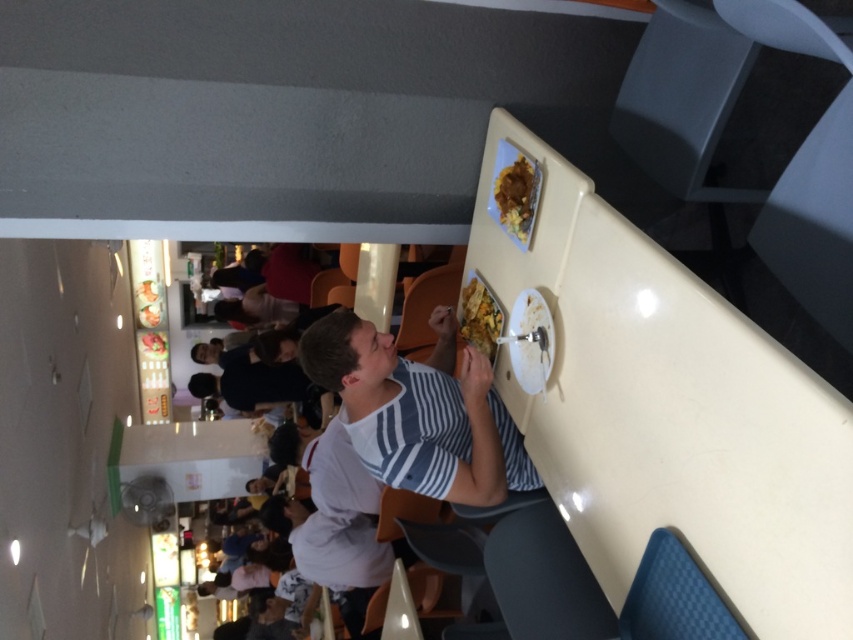
Question: Among these points, which one is farthest from the camera?

Choices:
 (A) (152, 296)
 (B) (148, 339)
 (C) (515, 179)
 (D) (148, 308)

Answer: (B)

Question: Is yellow matte food at upper right wider than matte white plate at upper center?

Choices:
 (A) yes
 (B) no

Answer: (B)

Question: Estimate the real-world distances between objects in this image. Which object is farther from the white striped shirt at center?

Choices:
 (A) yellow matte food at upper right
 (B) smooth yellow rice at upper center

Answer: (B)

Question: Among these objects, which one is farthest from the camera?

Choices:
 (A) smooth yellow rice at upper center
 (B) white striped shirt at center
 (C) matte white plate at upper center
 (D) matte plastic food at center

Answer: (C)

Question: Is matte plastic food at center smaller than smooth yellow rice at upper center?

Choices:
 (A) yes
 (B) no

Answer: (B)

Question: Does matte white plate at upper center come in front of smooth yellow rice at upper center?

Choices:
 (A) no
 (B) yes

Answer: (A)